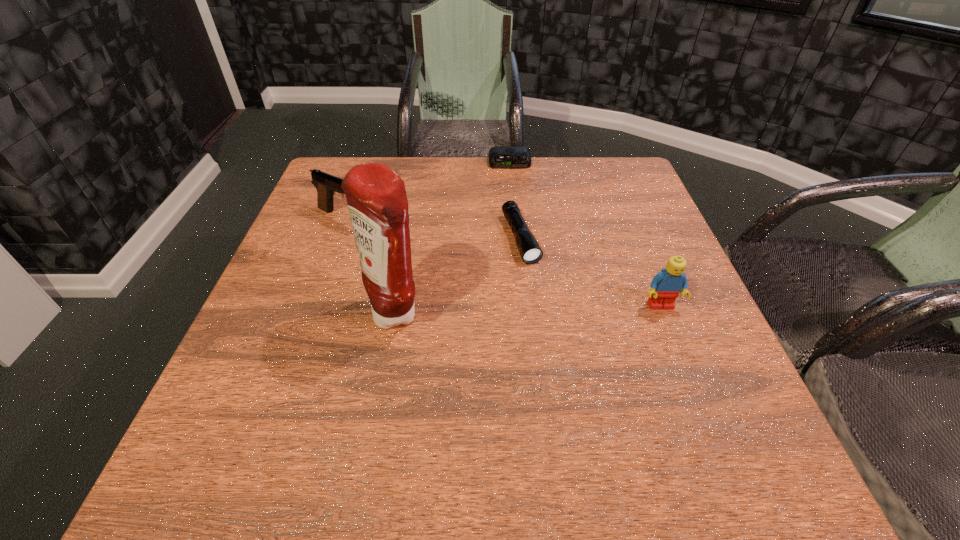
What are the coordinates of `object that is at the right edge` in the screenshot? It's located at (666, 286).

The width and height of the screenshot is (960, 540). What are the coordinates of `vacant space at the far edge of the desktop` in the screenshot? It's located at (433, 178).

Identify the location of vacant space at the near edge of the desktop. (511, 384).

Locate an element on the screen. This screenshot has width=960, height=540. blank space at the left edge of the desktop is located at coordinates pos(273,310).

Find the location of a particular element. This screenshot has height=540, width=960. vacant space at the right edge of the desktop is located at coordinates (670, 240).

At what (x,y) coordinates should I click in order to perform the action: click on vacant space at the far left corner of the desktop. Please return your answer as a coordinate pair (x, y). The height and width of the screenshot is (540, 960). Looking at the image, I should click on (346, 156).

I want to click on vacant space at the far right corner of the desktop, so click(x=610, y=200).

Locate an element on the screen. The width and height of the screenshot is (960, 540). vacant area that lies between the flashlight and the farthest object is located at coordinates (516, 200).

What are the coordinates of `free space between the second shortest object and the pistol` in the screenshot? It's located at (434, 228).

The height and width of the screenshot is (540, 960). I want to click on vacant area that lies between the rightmost object and the condiment, so click(529, 309).